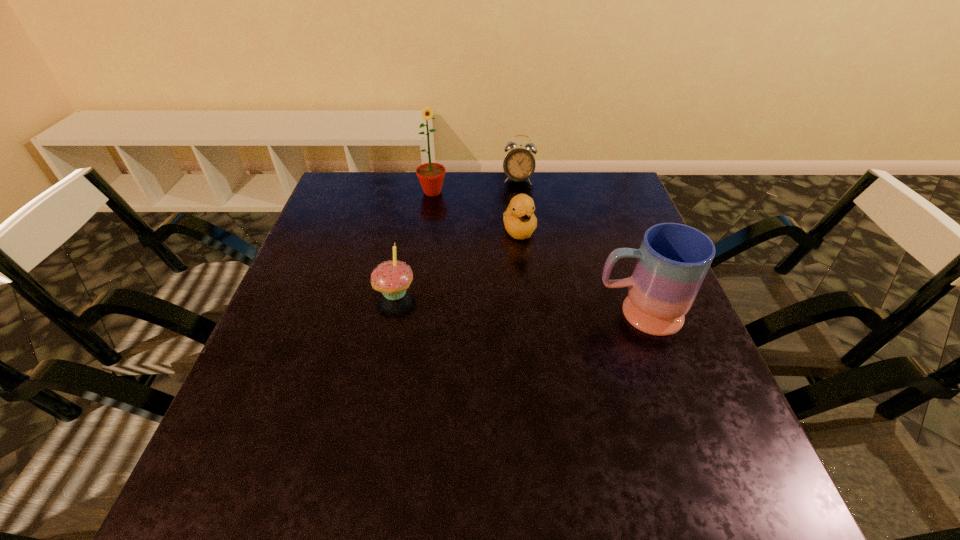
Where is `free space located 0.160m on the face of the sunflower`? free space located 0.160m on the face of the sunflower is located at coordinates (456, 230).

This screenshot has width=960, height=540. I want to click on free space located on the face of the sunflower, so click(x=465, y=245).

Image resolution: width=960 pixels, height=540 pixels. Find the location of `vacant space situated 0.220m on the face of the sunflower`. vacant space situated 0.220m on the face of the sunflower is located at coordinates (464, 242).

This screenshot has height=540, width=960. Identify the location of vacant space located facing forward on the third farthest object. (540, 309).

Where is `vacant space located facing forward on the third farthest object`? The image size is (960, 540). vacant space located facing forward on the third farthest object is located at coordinates (550, 341).

At what (x,y) coordinates should I click in order to perform the action: click on vacant space located 0.120m facing forward on the third farthest object. Please return your answer as a coordinate pair (x, y). Looking at the image, I should click on (532, 278).

Locate an element on the screen. free space located on the face of the alarm clock is located at coordinates (516, 200).

Find the location of a particular element. free location located on the face of the alarm clock is located at coordinates (513, 215).

Where is `free space located 0.130m on the face of the alarm clock`? The height and width of the screenshot is (540, 960). free space located 0.130m on the face of the alarm clock is located at coordinates (514, 211).

Locate an element on the screen. Image resolution: width=960 pixels, height=540 pixels. sunflower present at the far edge is located at coordinates (431, 175).